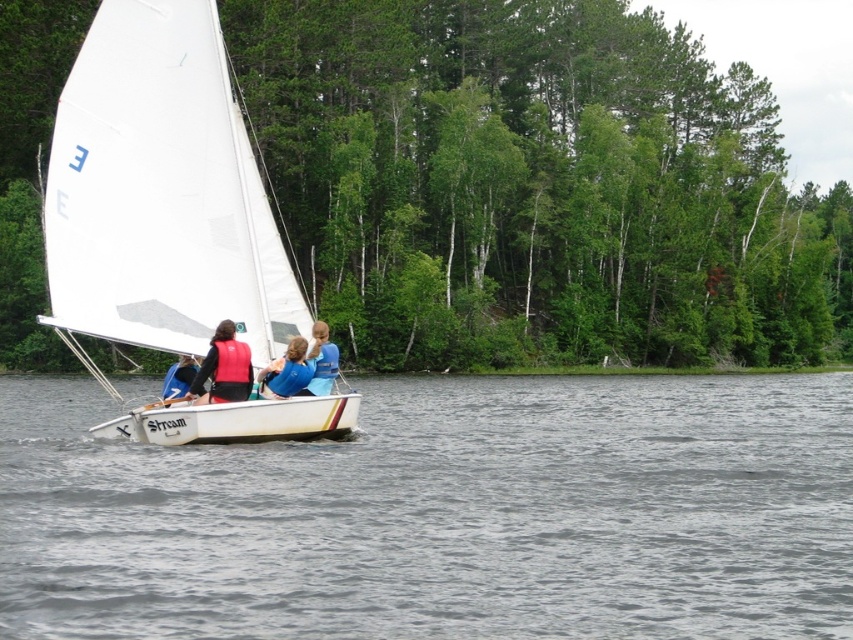
Question: Is orange life vest at center behind blue fabric shirt at center?

Choices:
 (A) no
 (B) yes

Answer: (A)

Question: Which point is closer to the camera taking this photo?

Choices:
 (A) (195, 369)
 (B) (310, 381)

Answer: (B)

Question: Is white sailboat at center wider than blue fabric shirt at center?

Choices:
 (A) no
 (B) yes

Answer: (B)

Question: Is blue fabric shirt at center bigger than red life vest at center?

Choices:
 (A) no
 (B) yes

Answer: (B)

Question: Among these objects, which one is nearest to the camera?

Choices:
 (A) blue padded life vest at center
 (B) gray water at center
 (C) white sailboat at center
 (D) blue fabric shirt at center

Answer: (B)

Question: Estimate the real-world distances between objects in this image. Which object is farther from the blue padded life vest at center?

Choices:
 (A) gray water at center
 (B) white sailboat at center
 (C) orange life vest at center

Answer: (A)